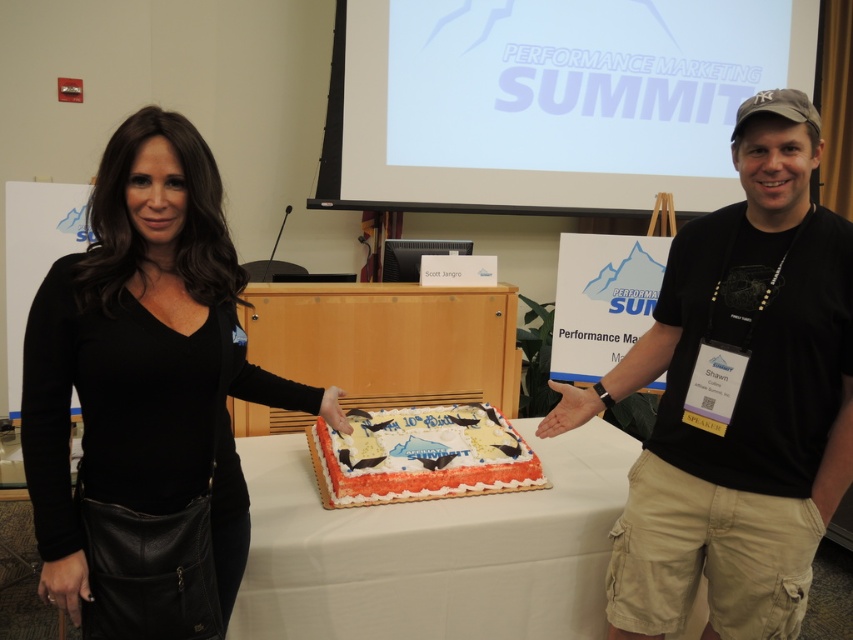
Question: Which point is farther to the camera?

Choices:
 (A) (376, 472)
 (B) (376, 604)
 (C) (210, 532)

Answer: (A)

Question: Which point is closer to the camera taking this photo?

Choices:
 (A) [337, 516]
 (B) [822, 384]
 (C) [480, 440]

Answer: (B)

Question: Is black leather jacket at center above white frosted cake at center?

Choices:
 (A) no
 (B) yes

Answer: (B)

Question: Can you confirm if black leather jacket at center is positioned to the left of white frosted cake at center?

Choices:
 (A) no
 (B) yes

Answer: (B)

Question: Which object appears farthest from the camera in this image?

Choices:
 (A) black t-shirt at center
 (B) black leather jacket at center
 (C) white frosted cake at center

Answer: (C)

Question: Is white paper table at center to the right of white frosted cake at center from the viewer's perspective?

Choices:
 (A) no
 (B) yes

Answer: (B)